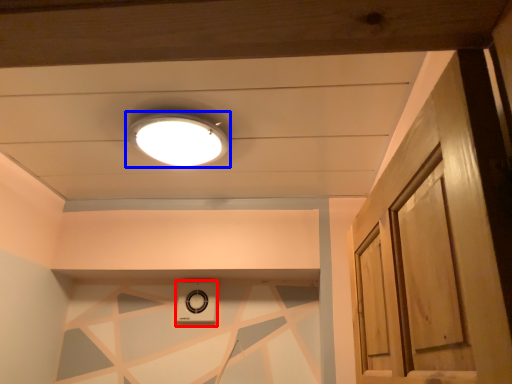
Question: Which point is further to the camera, appliance (highlighted by a red box) or lamp (highlighted by a blue box)?

Choices:
 (A) appliance
 (B) lamp

Answer: (A)